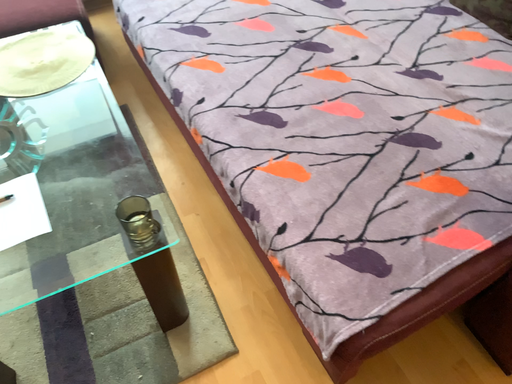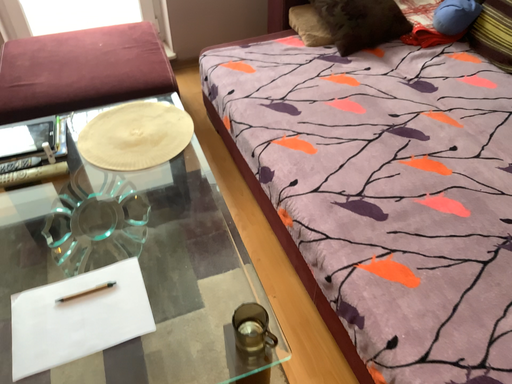
Question: Which way did the camera rotate in the video?

Choices:
 (A) rotated downward
 (B) rotated upward

Answer: (B)